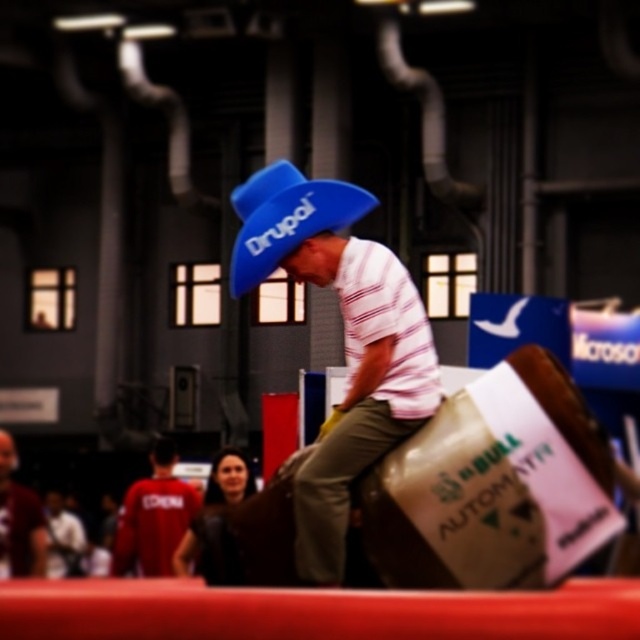
You are a photographer at the event and need to capture a clear photo of both the matte blue hat at center and the matte red shirt at left. Since you want both subjects to be in focus, will you need to adjust your camera to focus on the closer object first?

The matte blue hat at center is in front of the matte red shirt at left, so you should focus on the matte blue hat at center first to ensure both are in focus.